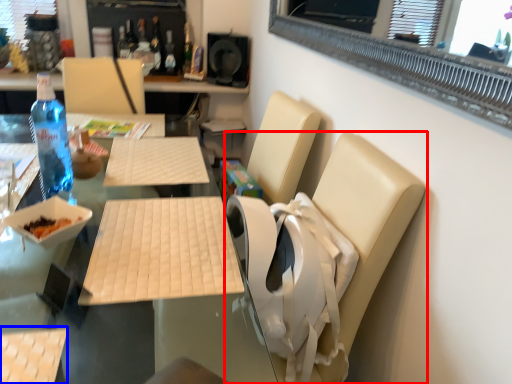
Question: Which object is further to the camera taking this photo, chair (highlighted by a red box) or armchair (highlighted by a blue box)?

Choices:
 (A) chair
 (B) armchair

Answer: (A)